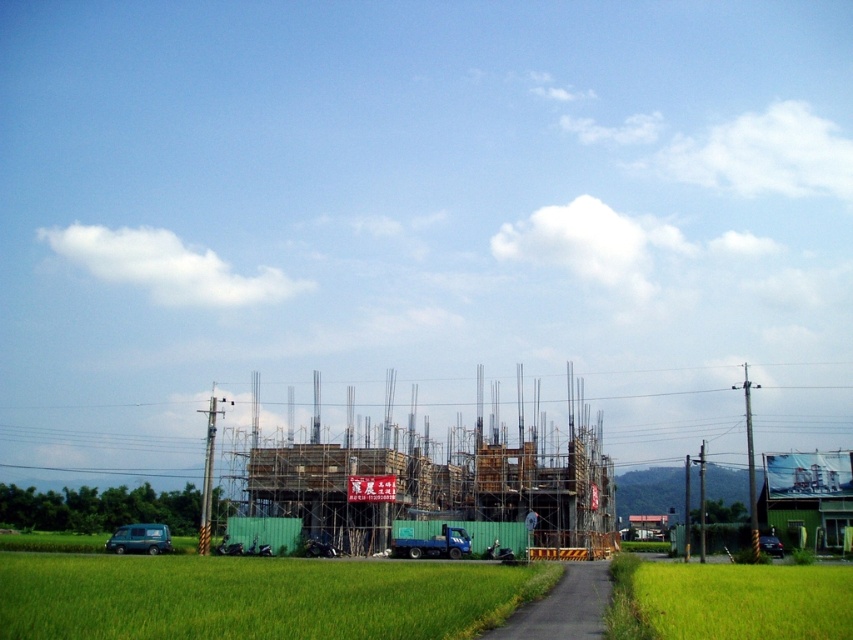
Question: Which of these objects is positioned closest to the wooden scaffolding at center?

Choices:
 (A) green grass at lower left
 (B) green grass at lower right

Answer: (A)

Question: Based on their relative distances, which object is farther from the green grass at lower left?

Choices:
 (A) green grass at lower right
 (B) wooden scaffolding at center

Answer: (B)

Question: Which point appears closest to the camera in this image?

Choices:
 (A) (759, 625)
 (B) (569, 531)
 (C) (225, 634)

Answer: (C)

Question: Is green grass at lower left to the right of green grass at lower right from the viewer's perspective?

Choices:
 (A) yes
 (B) no

Answer: (B)

Question: From the image, what is the correct spatial relationship of wooden scaffolding at center in relation to green grass at lower right?

Choices:
 (A) left
 (B) right

Answer: (A)

Question: Observing the image, what is the correct spatial positioning of wooden scaffolding at center in reference to green grass at lower right?

Choices:
 (A) right
 (B) left

Answer: (B)